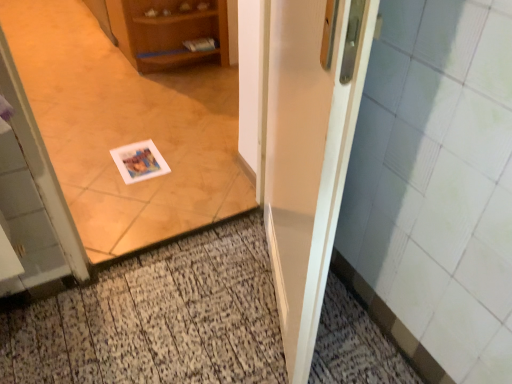
Question: Is the position of wooden cabinet at upper left more distant than that of white glossy door at center?

Choices:
 (A) no
 (B) yes

Answer: (B)

Question: Can you confirm if wooden cabinet at upper left is positioned to the left of white glossy door at center?

Choices:
 (A) yes
 (B) no

Answer: (A)

Question: From the image's perspective, is wooden cabinet at upper left located beneath white glossy door at center?

Choices:
 (A) no
 (B) yes

Answer: (A)

Question: Is wooden cabinet at upper left at the right side of white glossy door at center?

Choices:
 (A) yes
 (B) no

Answer: (B)

Question: Is wooden cabinet at upper left directly adjacent to white glossy door at center?

Choices:
 (A) yes
 (B) no

Answer: (B)

Question: Can you confirm if wooden cabinet at upper left is taller than white glossy door at center?

Choices:
 (A) yes
 (B) no

Answer: (B)

Question: Is white paper at center shorter than wooden cabinet at upper left?

Choices:
 (A) no
 (B) yes

Answer: (A)

Question: Is white paper at center to the left of wooden cabinet at upper left from the viewer's perspective?

Choices:
 (A) no
 (B) yes

Answer: (A)

Question: Is white paper at center taller than wooden cabinet at upper left?

Choices:
 (A) no
 (B) yes

Answer: (B)

Question: Can we say white paper at center lies outside wooden cabinet at upper left?

Choices:
 (A) yes
 (B) no

Answer: (A)

Question: Is white paper at center beside wooden cabinet at upper left?

Choices:
 (A) yes
 (B) no

Answer: (B)

Question: From a real-world perspective, is white paper at center physically below wooden cabinet at upper left?

Choices:
 (A) yes
 (B) no

Answer: (B)

Question: Considering the relative positions of white paper at center and white glossy door at center in the image provided, is white paper at center to the right of white glossy door at center from the viewer's perspective?

Choices:
 (A) yes
 (B) no

Answer: (B)